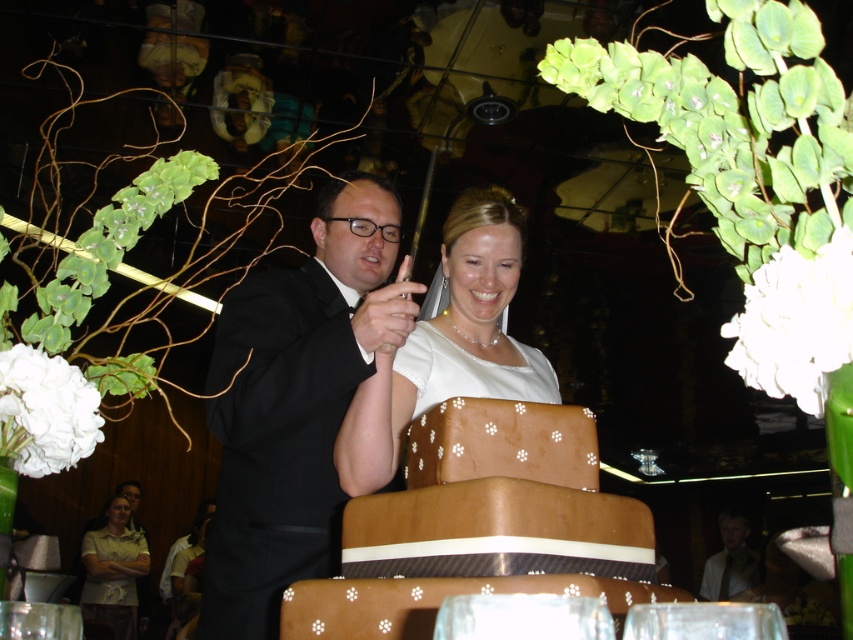
Does brown textured cake at center appear under white satin dress at center?

Correct, brown textured cake at center is located below white satin dress at center.

Looking at this image, does brown textured cake at center appear over white satin dress at center?

No, brown textured cake at center is not above white satin dress at center.

Between point (450, 563) and point (519, 369), which one is positioned behind?

The point (519, 369) is behind.

Find the location of `brown textured cake at center`. brown textured cake at center is located at coordinates (482, 525).

Can you confirm if black satin tuxedo at center is positioned to the right of brown textured cake at center?

In fact, black satin tuxedo at center is to the left of brown textured cake at center.

Between point (370, 344) and point (572, 518), which one is positioned behind?

The point (370, 344) is behind.

Where is `black satin tuxedo at center`? black satin tuxedo at center is located at coordinates (294, 403).

Which is behind, point (206, 577) or point (364, 424)?

The point (206, 577) is behind.

Where is `black satin tuxedo at center`? The height and width of the screenshot is (640, 853). black satin tuxedo at center is located at coordinates (294, 403).

Describe the element at coordinates (294, 403) in the screenshot. Image resolution: width=853 pixels, height=640 pixels. I see `black satin tuxedo at center` at that location.

Locate an element on the screen. black satin tuxedo at center is located at coordinates (294, 403).